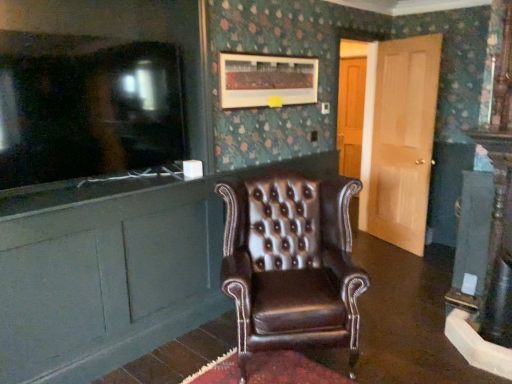
Where is `vacant space to the right of brown leather wingback chair at center`? vacant space to the right of brown leather wingback chair at center is located at coordinates (393, 338).